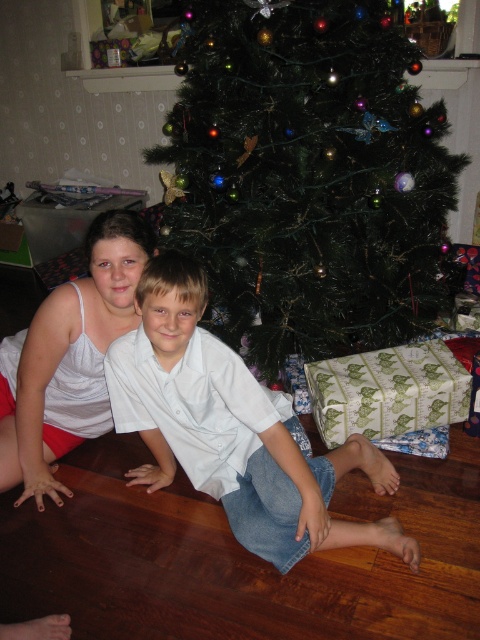
Question: Which of these objects is positioned closest to the white cotton tank top at center?

Choices:
 (A) green matte christmas tree at center
 (B) green striped paper at lower right
 (C) white cotton shirt at center

Answer: (C)

Question: Is green matte christmas tree at center behind green striped paper at lower right?

Choices:
 (A) yes
 (B) no

Answer: (B)

Question: Which object is farther from the camera taking this photo?

Choices:
 (A) green striped paper at lower right
 (B) white cotton shirt at center
 (C) white cotton tank top at center
 (D) green matte christmas tree at center

Answer: (A)

Question: Does white cotton tank top at center have a lesser width compared to green striped paper at lower right?

Choices:
 (A) no
 (B) yes

Answer: (B)

Question: Which object appears closest to the camera in this image?

Choices:
 (A) green matte christmas tree at center
 (B) green striped paper at lower right
 (C) white cotton tank top at center
 (D) white cotton shirt at center

Answer: (D)

Question: From the image, what is the correct spatial relationship of green matte christmas tree at center in relation to white cotton shirt at center?

Choices:
 (A) above
 (B) below

Answer: (A)